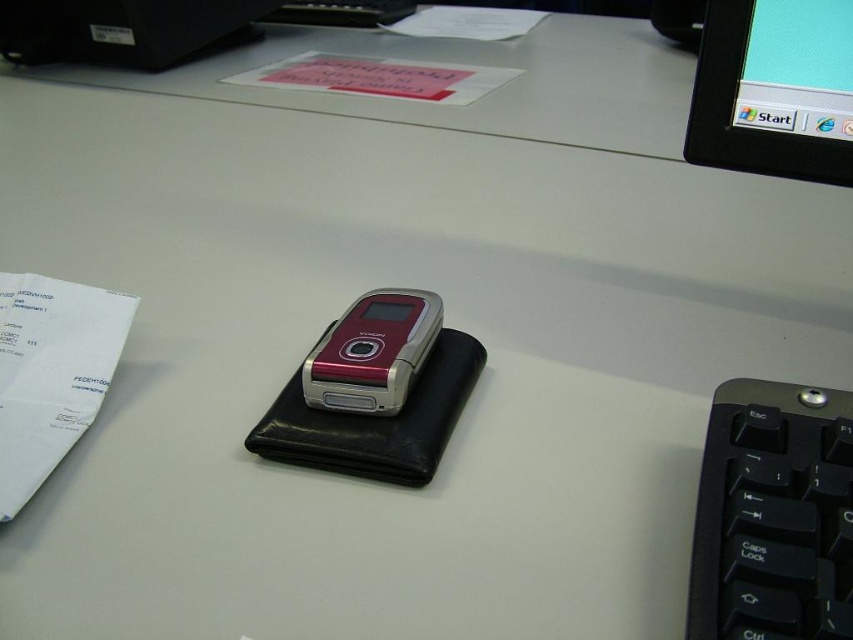
From the picture: Which is more to the right, black glossy monitor at upper right or metallic red phone at center?

Positioned to the right is black glossy monitor at upper right.

The width and height of the screenshot is (853, 640). What do you see at coordinates (775, 90) in the screenshot? I see `black glossy monitor at upper right` at bounding box center [775, 90].

You are a GUI agent. You are given a task and a screenshot of the screen. Output one action in this format:
    pyautogui.click(x=<x>, y=<y>)
    Task: Click on the black glossy monitor at upper right
    
    Given the screenshot: What is the action you would take?
    pyautogui.click(x=775, y=90)

The width and height of the screenshot is (853, 640). What do you see at coordinates (773, 513) in the screenshot?
I see `black plastic keyboard at lower right` at bounding box center [773, 513].

Is black plastic keyboard at lower right above metallic red phone at center?

Actually, black plastic keyboard at lower right is below metallic red phone at center.

This screenshot has height=640, width=853. What are the coordinates of `black plastic keyboard at lower right` in the screenshot? It's located at (773, 513).

This screenshot has width=853, height=640. Find the location of `black plastic keyboard at lower right`. black plastic keyboard at lower right is located at coordinates (773, 513).

Identify the location of white paper at left. (51, 372).

Where is `white paper at left`? Image resolution: width=853 pixels, height=640 pixels. white paper at left is located at coordinates (51, 372).